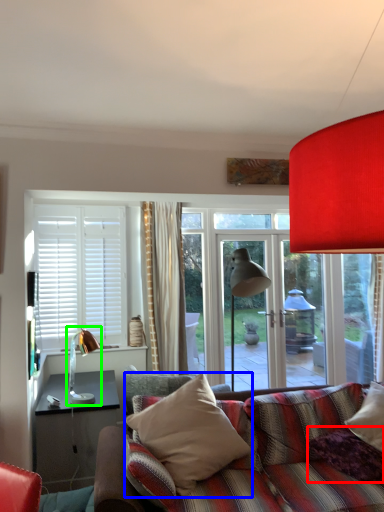
Question: Based on their relative distances, which object is farther from pillow (highlighted by a red box)? Choose from pillow (highlighted by a blue box) and table lamp (highlighted by a green box).

Choices:
 (A) pillow
 (B) table lamp

Answer: (B)